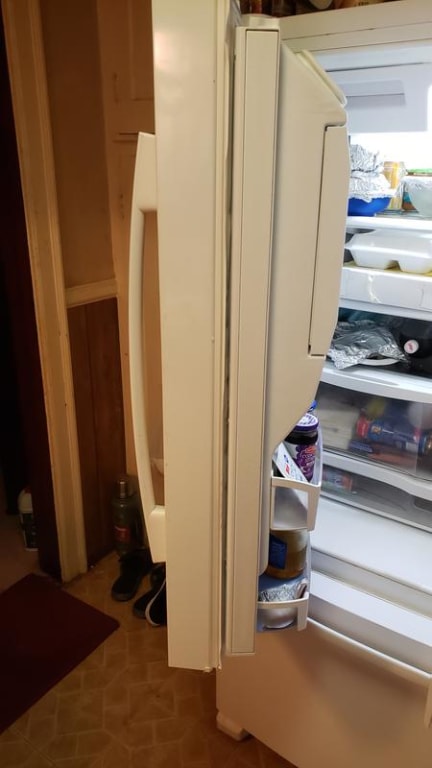
This screenshot has height=768, width=432. I want to click on can of soda in refrigerator, so click(397, 167).